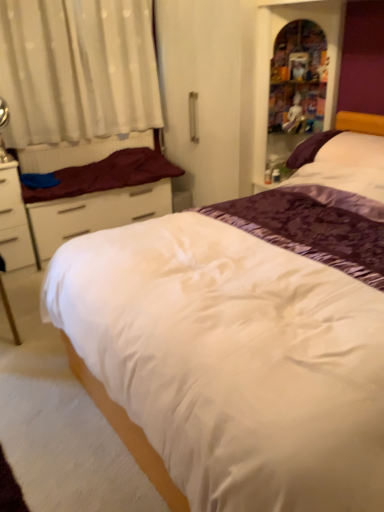
Question: From a real-world perspective, is white matte drawer at left over maroon fabric mattress at left?

Choices:
 (A) no
 (B) yes

Answer: (A)

Question: Is the depth of white matte drawer at left greater than that of maroon fabric mattress at left?

Choices:
 (A) no
 (B) yes

Answer: (B)

Question: From the image's perspective, is white matte drawer at left below maroon fabric mattress at left?

Choices:
 (A) yes
 (B) no

Answer: (A)

Question: Does white matte drawer at left have a larger size compared to maroon fabric mattress at left?

Choices:
 (A) no
 (B) yes

Answer: (B)

Question: Is white matte drawer at left positioned with its back to maroon fabric mattress at left?

Choices:
 (A) yes
 (B) no

Answer: (B)

Question: Is metallic silver table lamp at left inside or outside of purple satin pillow at upper right?

Choices:
 (A) outside
 (B) inside

Answer: (A)

Question: Is point (3, 110) closer or farther from the camera than point (382, 150)?

Choices:
 (A) farther
 (B) closer

Answer: (A)

Question: In terms of size, does metallic silver table lamp at left appear bigger or smaller than purple satin pillow at upper right?

Choices:
 (A) small
 (B) big

Answer: (A)

Question: From a real-world perspective, is metallic silver table lamp at left physically located above or below purple satin pillow at upper right?

Choices:
 (A) above
 (B) below

Answer: (A)

Question: In terms of height, does white satin bed at center look taller or shorter compared to white matte drawer at left?

Choices:
 (A) tall
 (B) short

Answer: (A)

Question: From the image's perspective, relative to white matte drawer at left, is white satin bed at center above or below?

Choices:
 (A) below
 (B) above

Answer: (A)

Question: Based on their sizes in the image, would you say white satin bed at center is bigger or smaller than white matte drawer at left?

Choices:
 (A) small
 (B) big

Answer: (B)

Question: Is white satin bed at center to the left or to the right of white matte drawer at left in the image?

Choices:
 (A) right
 (B) left

Answer: (A)

Question: Considering the positions of purple satin pillow at upper right and maroon fabric mattress at left in the image, is purple satin pillow at upper right taller or shorter than maroon fabric mattress at left?

Choices:
 (A) short
 (B) tall

Answer: (B)

Question: Relative to maroon fabric mattress at left, is purple satin pillow at upper right in front or behind?

Choices:
 (A) front
 (B) behind

Answer: (A)